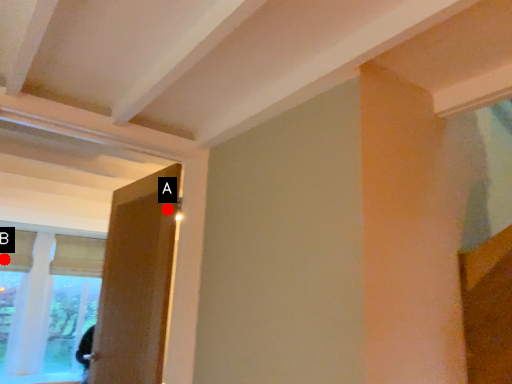
Question: Two points are circled on the image, labeled by A and B beside each circle. Which of the following is the farthest from the observer?

Choices:
 (A) A is further
 (B) B is further

Answer: (B)